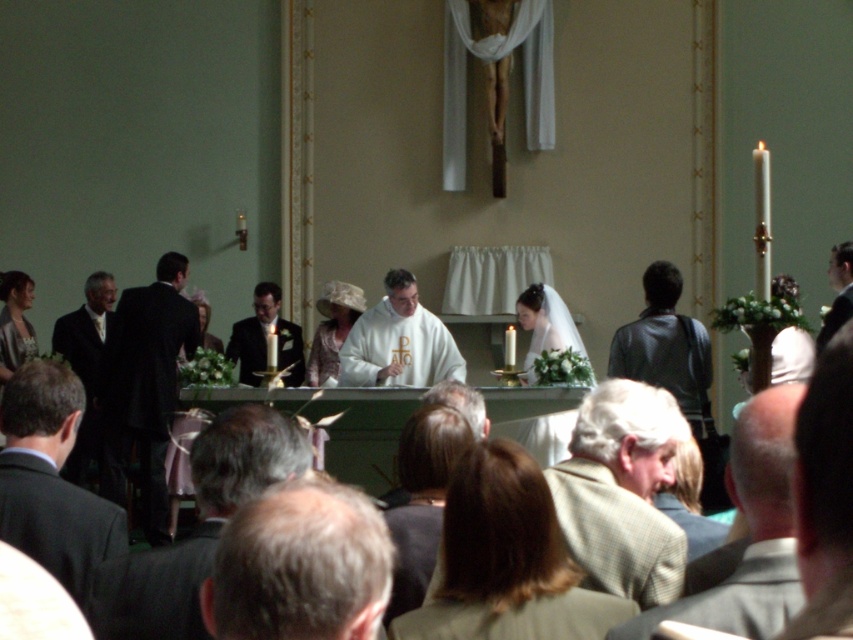
Question: From the image, what is the correct spatial relationship of light brown hair at lower right in relation to light beige lace dress at center?

Choices:
 (A) below
 (B) above

Answer: (A)

Question: Which point is farther from the camera taking this photo?

Choices:
 (A) (12, 342)
 (B) (112, 428)

Answer: (A)

Question: Is shiny black suit at center below light brown hair at upper right?

Choices:
 (A) no
 (B) yes

Answer: (B)

Question: Is dark gray suit at lower left thinner than black suit at lower left?

Choices:
 (A) no
 (B) yes

Answer: (A)

Question: Estimate the real-world distances between objects in this image. Which object is closer to the dark suit at left?

Choices:
 (A) shiny black suit at center
 (B) matte white dress at left
 (C) white satin veil at center

Answer: (A)

Question: Which point is farther from the camera taking this photo?

Choices:
 (A) (824, 323)
 (B) (540, 316)
 (C) (105, 328)

Answer: (C)